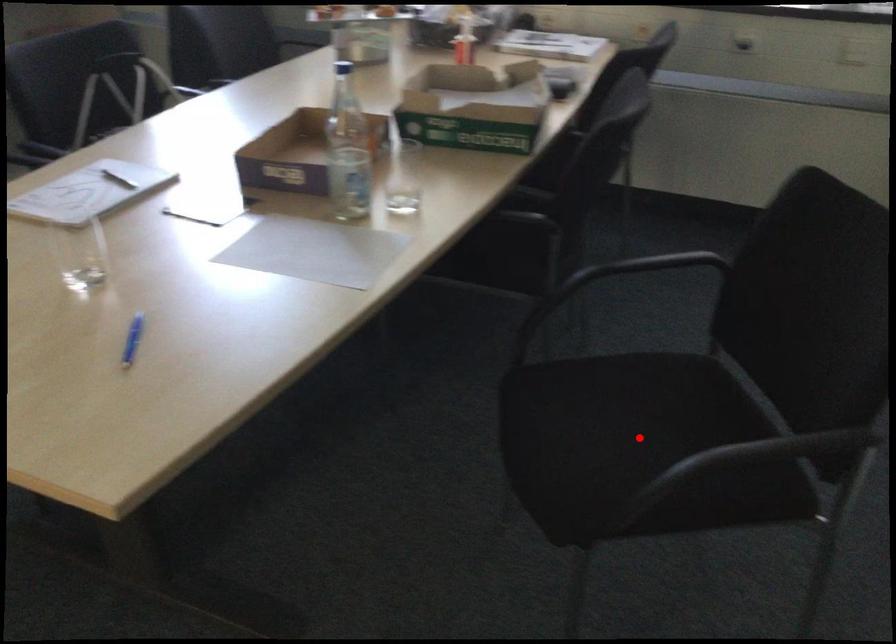
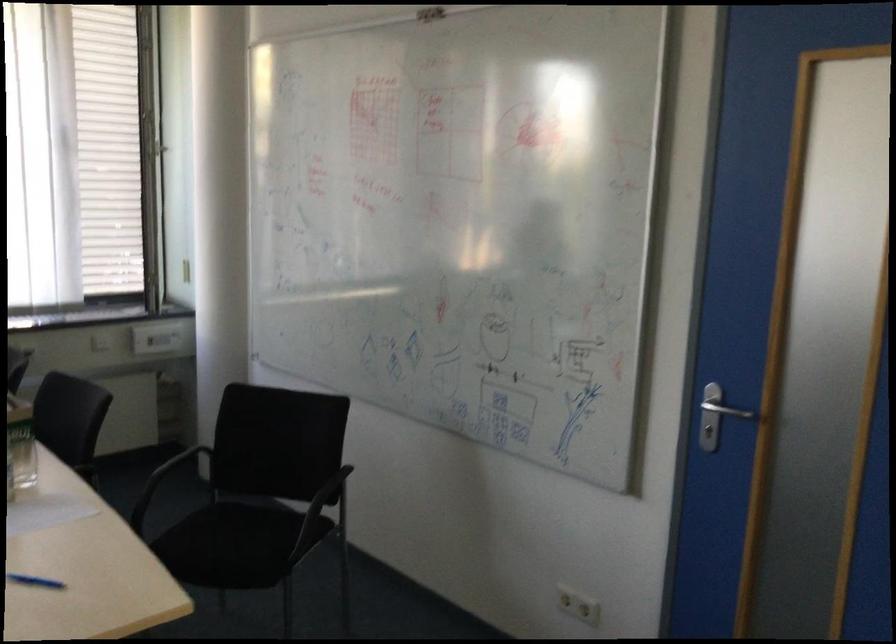
In the second image, find the point that corresponds to the highlighted location in the first image.

(251, 529)